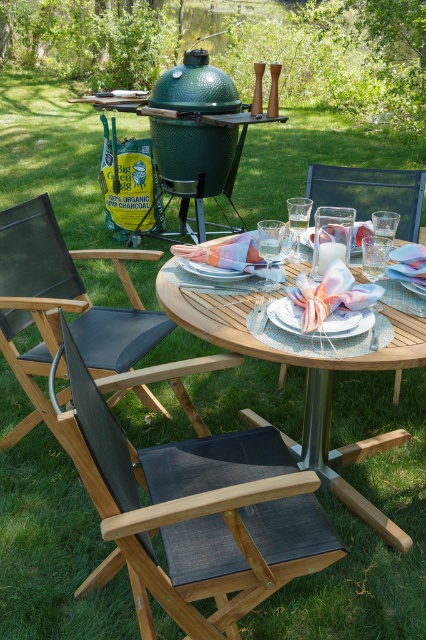
Question: Considering the relative positions of dark gray fabric folding chair at lower left and black fabric chair at center in the image provided, where is dark gray fabric folding chair at lower left located with respect to black fabric chair at center?

Choices:
 (A) right
 (B) left

Answer: (B)

Question: Which object appears closest to the camera in this image?

Choices:
 (A) wooden table at center
 (B) black fabric chair at center

Answer: (A)

Question: Where is black fabric chair at lower left located in relation to wooden table at center in the image?

Choices:
 (A) above
 (B) below

Answer: (A)

Question: In this image, where is dark gray fabric folding chair at lower left located relative to pastel fabric napkin at center?

Choices:
 (A) below
 (B) above

Answer: (A)

Question: Which is nearer to the pastel fabric napkin at center?

Choices:
 (A) black fabric chair at lower left
 (B) black fabric chair at center
 (C) dark gray fabric folding chair at lower left
 (D) wooden table at center

Answer: (D)

Question: Which object is the farthest from the black fabric chair at lower left?

Choices:
 (A) wooden table at center
 (B) pastel fabric napkin at center
 (C) dark gray fabric folding chair at lower left

Answer: (B)